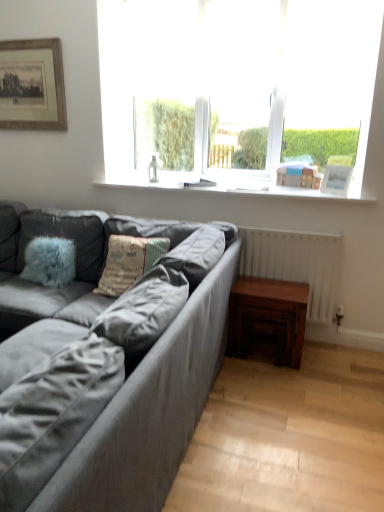
At what (x,y) coordinates should I click in order to perform the action: click on free spot above wooden framed print at upper left, the 1th picture frame positioned from the left (from a real-world perspective). Please return your answer as a coordinate pair (x, y). Looking at the image, I should click on (32, 39).